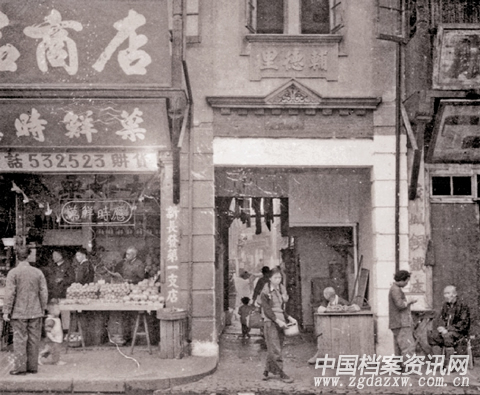
Find the location of a particular element. Image resolution: width=480 pixels, height=395 pixels. windows is located at coordinates (270, 21), (309, 16), (442, 182), (462, 187), (452, 128).